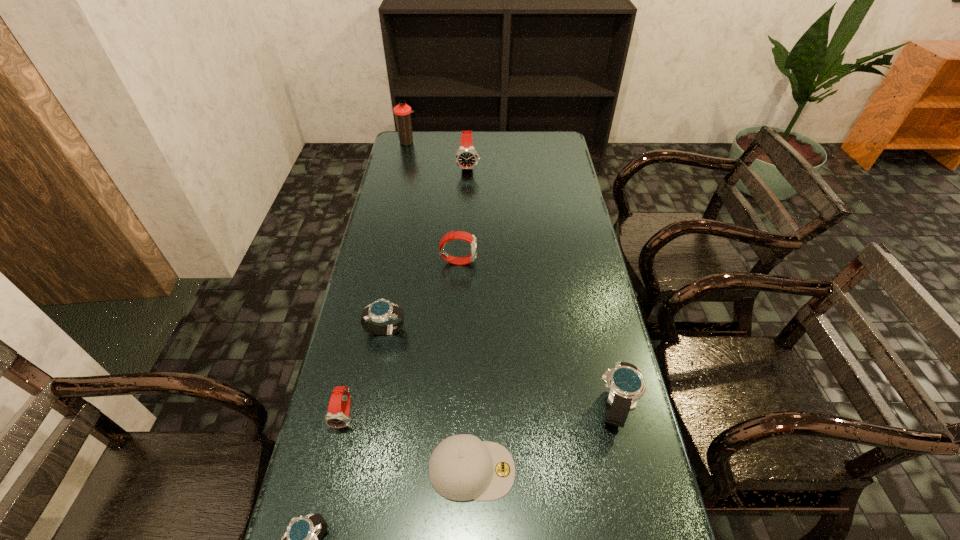
Where is `the leftmost red watch`? This screenshot has height=540, width=960. the leftmost red watch is located at coordinates (337, 416).

Locate an element on the screen. The height and width of the screenshot is (540, 960). the nearest red watch is located at coordinates (337, 416).

Where is `gray cap`? gray cap is located at coordinates (462, 467).

Image resolution: width=960 pixels, height=540 pixels. In order to click on the seventh farthest object in this screenshot , I will do `click(462, 467)`.

The width and height of the screenshot is (960, 540). What are the coordinates of `free space located on the front of the tallest object` in the screenshot? It's located at (396, 191).

Locate an element on the screen. This screenshot has width=960, height=540. vacant position located on the face of the farthest watch is located at coordinates (467, 217).

Where is `free space located 0.060m on the left of the rightmost silver watch`? free space located 0.060m on the left of the rightmost silver watch is located at coordinates (570, 407).

Find the location of a particular element. vacant space located on the face of the second biggest red watch is located at coordinates (570, 261).

The width and height of the screenshot is (960, 540). Find the location of `free location located 0.140m on the back of the second biggest silver watch`. free location located 0.140m on the back of the second biggest silver watch is located at coordinates (394, 284).

Identify the location of vacant area situated 0.140m on the face of the leftmost red watch. (327, 494).